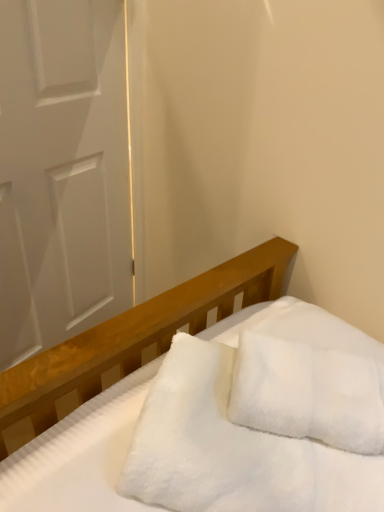
The width and height of the screenshot is (384, 512). What do you see at coordinates (307, 393) in the screenshot?
I see `white fluffy pillow at center` at bounding box center [307, 393].

Where is `white matte door at left`? This screenshot has height=512, width=384. white matte door at left is located at coordinates (62, 172).

Which is closer to the camera, [21,201] or [246,490]?

Point [21,201] is positioned farther from the camera compared to point [246,490].

What are the coordinates of `door located behind the white fluffy blanket at center` in the screenshot? It's located at (62, 172).

How different are the orientations of white matte door at left and white fluffy blanket at center in degrees?

27.2 degrees.

Considering the positions of objects white fluffy pillow at center and white matte door at left in the image provided, who is more to the left, white fluffy pillow at center or white matte door at left?

white matte door at left is more to the left.

You are a GUI agent. You are given a task and a screenshot of the screen. Output one action in this format:
    pyautogui.click(x=<x>, y=<y>)
    Task: Click on the door lying behind the white fluffy pillow at center
    The width and height of the screenshot is (384, 512).
    Given the screenshot: What is the action you would take?
    pos(62,172)

Considering the sizes of objects white fluffy pillow at center and white matte door at left in the image provided, who is shorter, white fluffy pillow at center or white matte door at left?

white fluffy pillow at center is shorter.

Considering the sizes of objects white matte door at left and white fluffy pillow at center in the image provided, who is wider, white matte door at left or white fluffy pillow at center?

white fluffy pillow at center.

Is white matte door at left next to white fluffy pillow at center?

No, white matte door at left is not making contact with white fluffy pillow at center.

Considering the relative sizes of white matte door at left and white fluffy pillow at center in the image provided, is white matte door at left taller than white fluffy pillow at center?

Yes.

This screenshot has width=384, height=512. I want to click on blanket on the left of white fluffy pillow at center, so click(233, 449).

Is the surface of white fluffy blanket at center in direct contact with white fluffy pillow at center?

Indeed, white fluffy blanket at center and white fluffy pillow at center are beside each other and touching.

Looking at this image, from a real-world perspective, relative to white fluffy pillow at center, is white fluffy blanket at center vertically above or below?

From a real-world perspective, white fluffy blanket at center is physically below white fluffy pillow at center.

Does white fluffy blanket at center come behind white fluffy pillow at center?

No, white fluffy blanket at center is closer to the viewer.

Is white fluffy pillow at center not within white fluffy blanket at center?

Actually, white fluffy pillow at center is within white fluffy blanket at center.

Is white fluffy pillow at center beside white fluffy blanket at center?

Yes, white fluffy pillow at center is next to white fluffy blanket at center.

Is white fluffy pillow at center at the left side of white fluffy blanket at center?

Incorrect, white fluffy pillow at center is not on the left side of white fluffy blanket at center.

You are a GUI agent. You are given a task and a screenshot of the screen. Output one action in this format:
    pyautogui.click(x=<x>, y=<y>)
    Task: Click on the blanket that appears in front of the white fluffy pillow at center
    The image size is (384, 512).
    Given the screenshot: What is the action you would take?
    pyautogui.click(x=233, y=449)

Based on their sizes in the image, would you say white fluffy blanket at center is bigger or smaller than white matte door at left?

white fluffy blanket at center is smaller than white matte door at left.

Would you say white fluffy blanket at center is a long distance from white matte door at left?

No, white fluffy blanket at center is not far away from white matte door at left.

From a real-world perspective, is white fluffy blanket at center below white matte door at left?

Incorrect, from a real-world perspective, white fluffy blanket at center is higher than white matte door at left.

What are the coordinates of `blanket located on the right of white matte door at left` in the screenshot? It's located at (233, 449).

Identify the location of door on the left side of white fluffy pillow at center. (62, 172).

Looking at this image, based on their spatial positions, is white fluffy blanket at center or white fluffy pillow at center closer to white matte door at left?

white fluffy blanket at center lies closer to white matte door at left than the other object.

Estimate the real-world distances between objects in this image. Which object is closer to white fluffy blanket at center, white fluffy pillow at center or white matte door at left?

Among the two, white fluffy pillow at center is located nearer to white fluffy blanket at center.

Based on their spatial positions, is white matte door at left or white fluffy pillow at center closer to white fluffy blanket at center?

white fluffy pillow at center is closer to white fluffy blanket at center.

From the image, which object appears to be farther from white fluffy pillow at center, white fluffy blanket at center or white matte door at left?

The object further to white fluffy pillow at center is white matte door at left.

Estimate the real-world distances between objects in this image. Which object is closer to white fluffy pillow at center, white matte door at left or white fluffy blanket at center?

The object closer to white fluffy pillow at center is white fluffy blanket at center.

Considering their positions, is white fluffy pillow at center positioned further to white matte door at left than white fluffy blanket at center?

white fluffy pillow at center is further to white matte door at left.

At what (x,y) coordinates should I click in order to perform the action: click on blanket situated between white matte door at left and white fluffy pillow at center from left to right. Please return your answer as a coordinate pair (x, y). The width and height of the screenshot is (384, 512). Looking at the image, I should click on (233, 449).